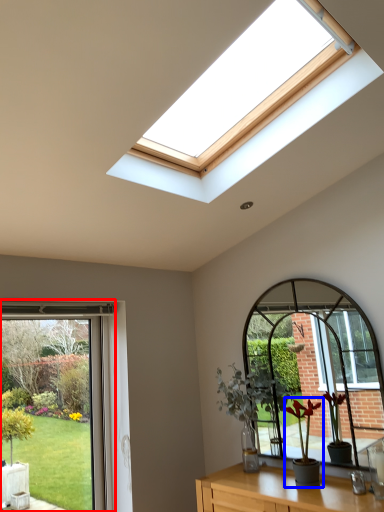
Question: Among these objects, which one is farthest to the camera, window (highlighted by a red box) or houseplant (highlighted by a blue box)?

Choices:
 (A) window
 (B) houseplant

Answer: (A)